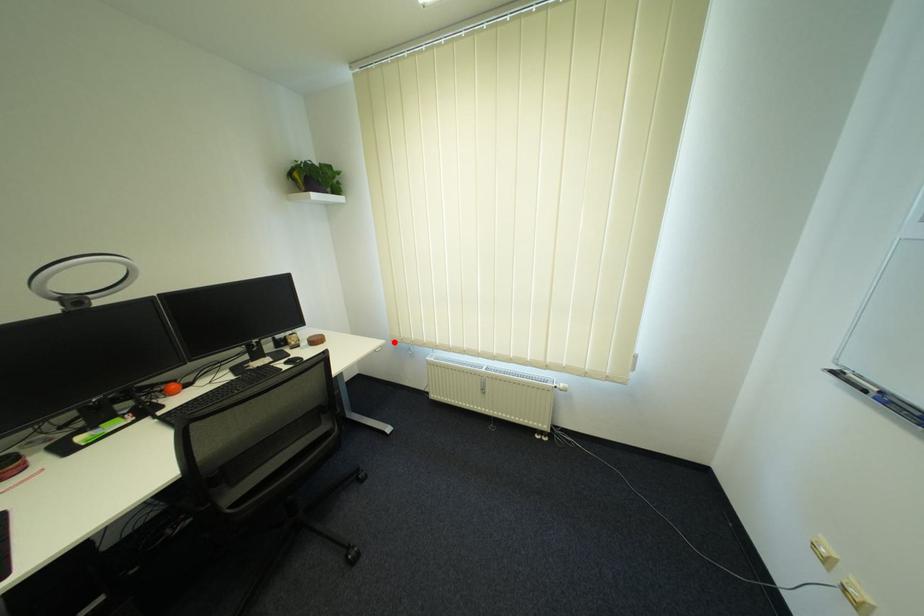
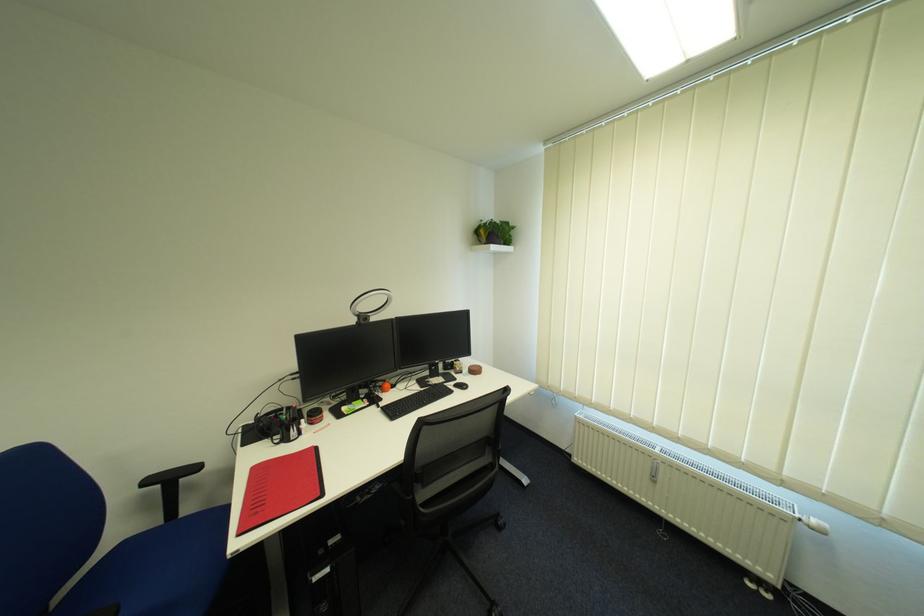
Where in the second image is the point corresponding to the highlighted location from the first image?

(548, 387)